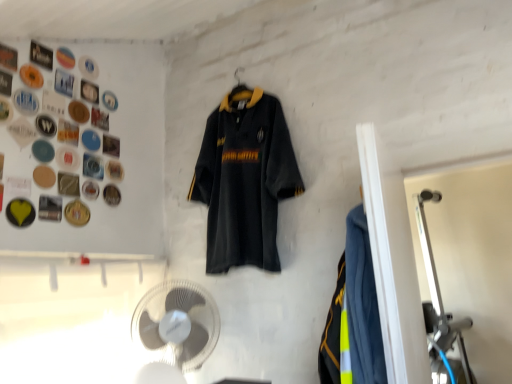
Question: Does metallic silver button at upper left, which ranks as the 10th button in bottom-to-top order, have a greater height compared to metallic silver button at upper left, placed as the 7th button when sorted from top to bottom?

Choices:
 (A) no
 (B) yes

Answer: (A)

Question: Is metallic silver button at upper left, which ranks as the 10th button in bottom-to-top order, at the left side of metallic silver button at upper left, arranged as the 7th button when ordered from the bottom?

Choices:
 (A) no
 (B) yes

Answer: (A)

Question: Is metallic silver button at upper left, which ranks as the 10th button in bottom-to-top order, closer to the viewer compared to metallic silver button at upper left, arranged as the 7th button when ordered from the bottom?

Choices:
 (A) yes
 (B) no

Answer: (B)

Question: Is metallic silver button at upper left, which ranks as the 10th button in bottom-to-top order, touching metallic silver button at upper left, placed as the 7th button when sorted from top to bottom?

Choices:
 (A) yes
 (B) no

Answer: (B)

Question: Is metallic silver button at upper left, which ranks as the 10th button in bottom-to-top order, further to the viewer compared to metallic silver button at upper left, arranged as the 7th button when ordered from the bottom?

Choices:
 (A) yes
 (B) no

Answer: (A)

Question: Does metallic silver button at upper left, marked as the 4th button in a top-to-bottom arrangement, have a lesser width compared to metallic silver button at upper left, placed as the 7th button when sorted from top to bottom?

Choices:
 (A) yes
 (B) no

Answer: (A)

Question: Can you confirm if matte black button at upper left, the 6th button from the bottom, is positioned to the left of white plastic fan at lower center?

Choices:
 (A) yes
 (B) no

Answer: (A)

Question: Is matte black button at upper left, the 6th button from the bottom, oriented towards white plastic fan at lower center?

Choices:
 (A) no
 (B) yes

Answer: (A)

Question: Can you confirm if matte black button at upper left, positioned as the 8th button in top-to-bottom order, is bigger than white plastic fan at lower center?

Choices:
 (A) yes
 (B) no

Answer: (B)

Question: Considering the relative positions of matte black button at upper left, the 6th button from the bottom, and white plastic fan at lower center in the image provided, is matte black button at upper left, the 6th button from the bottom, to the right of white plastic fan at lower center from the viewer's perspective?

Choices:
 (A) no
 (B) yes

Answer: (A)

Question: Is matte black button at upper left, the 6th button from the bottom, outside of white plastic fan at lower center?

Choices:
 (A) no
 (B) yes

Answer: (B)

Question: From the image's perspective, is matte black button at upper left, the 6th button from the bottom, on white plastic fan at lower center?

Choices:
 (A) no
 (B) yes

Answer: (B)

Question: Is metallic gold button at upper left, which ranks as the third button in bottom-to-top order, outside of metallic silver button at upper left, placed as the 11th button when sorted from bottom to top?

Choices:
 (A) no
 (B) yes

Answer: (B)